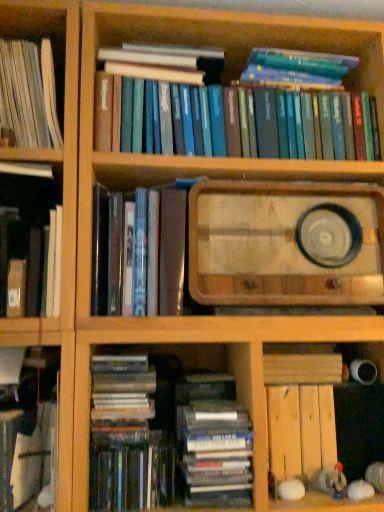
Question: Which direction should I rotate to face hardcover books at upper center, positioned as the 2th book in top-to-bottom order, — up or down?

Choices:
 (A) down
 (B) up

Answer: (B)

Question: Is hardcover book at lower left, which appears as the 7th book when viewed from the top, shorter than hardcover book at lower center, the first book in the bottom-to-top sequence?

Choices:
 (A) yes
 (B) no

Answer: (B)

Question: Can you confirm if hardcover book at lower left, arranged as the 2th book when ordered from the bottom, is positioned to the right of hardcover book at lower center, the 8th book viewed from the top?

Choices:
 (A) no
 (B) yes

Answer: (A)

Question: From the image's perspective, does hardcover book at lower left, which appears as the 7th book when viewed from the top, appear higher than hardcover book at lower center, the 8th book viewed from the top?

Choices:
 (A) no
 (B) yes

Answer: (B)

Question: Is hardcover book at lower left, which appears as the 7th book when viewed from the top, oriented towards hardcover book at lower center, the 8th book viewed from the top?

Choices:
 (A) no
 (B) yes

Answer: (A)

Question: Is hardcover book at lower left, arranged as the 2th book when ordered from the bottom, further to the viewer compared to hardcover book at lower center, the 8th book viewed from the top?

Choices:
 (A) no
 (B) yes

Answer: (A)

Question: Is hardcover book at lower left, arranged as the 2th book when ordered from the bottom, smaller than hardcover book at lower center, the first book in the bottom-to-top sequence?

Choices:
 (A) no
 (B) yes

Answer: (A)

Question: Could you tell me if hardcover books at upper center, placed as the 7th book when sorted from bottom to top, is turned towards wooden radio at center?

Choices:
 (A) no
 (B) yes

Answer: (A)

Question: Can you confirm if hardcover books at upper center, placed as the 7th book when sorted from bottom to top, is positioned to the right of wooden radio at center?

Choices:
 (A) no
 (B) yes

Answer: (A)

Question: Can you confirm if hardcover books at upper center, placed as the 7th book when sorted from bottom to top, is wider than wooden radio at center?

Choices:
 (A) no
 (B) yes

Answer: (A)

Question: From a real-world perspective, is hardcover books at upper center, positioned as the 2th book in top-to-bottom order, located beneath wooden radio at center?

Choices:
 (A) no
 (B) yes

Answer: (A)

Question: Is the position of hardcover books at upper center, positioned as the 2th book in top-to-bottom order, less distant than that of wooden radio at center?

Choices:
 (A) no
 (B) yes

Answer: (A)

Question: Can you confirm if hardcover books at upper center, placed as the 7th book when sorted from bottom to top, is thinner than wooden radio at center?

Choices:
 (A) no
 (B) yes

Answer: (B)

Question: Is the depth of white paper book at left, which is the eighth book from bottom to top, greater than that of hardcover book at left, the 5th book from the bottom?

Choices:
 (A) no
 (B) yes

Answer: (B)